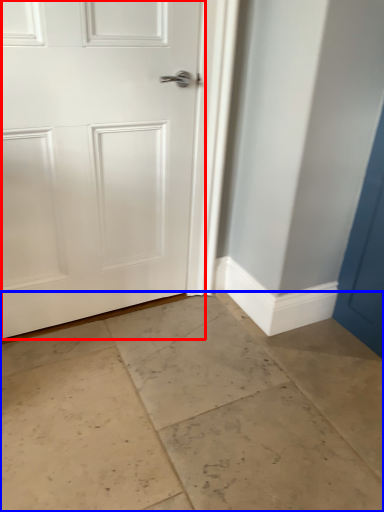
Question: Which object is closer to the camera taking this photo, door (highlighted by a red box) or concrete (highlighted by a blue box)?

Choices:
 (A) door
 (B) concrete

Answer: (B)